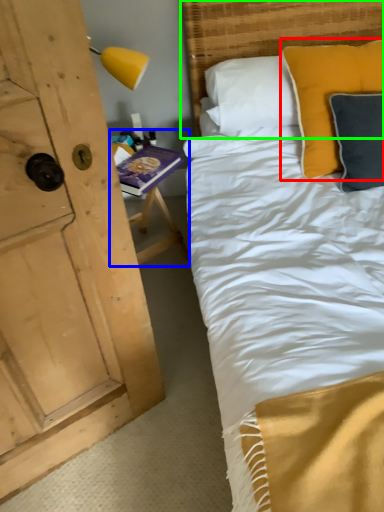
Question: Estimate the real-world distances between objects in this image. Which object is farther from pillow (highlighted by a red box), table (highlighted by a blue box) or headboard (highlighted by a green box)?

Choices:
 (A) table
 (B) headboard

Answer: (A)